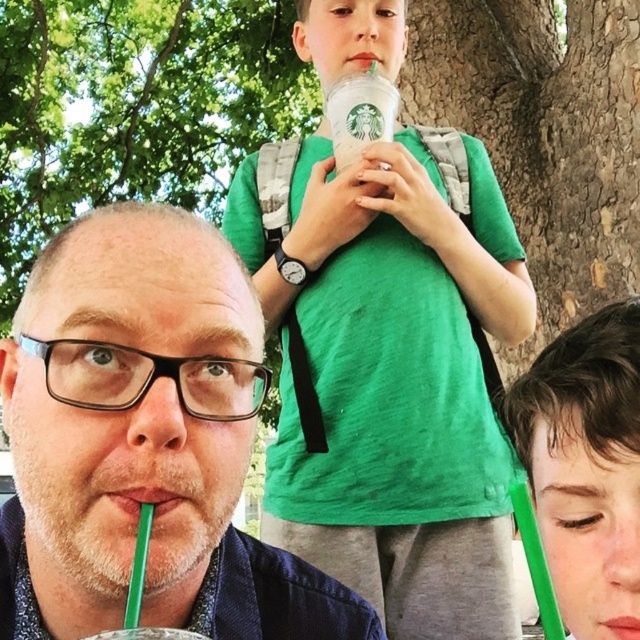
The image size is (640, 640). Describe the element at coordinates (392, 381) in the screenshot. I see `green matte shirt at center` at that location.

Who is more forward, (301, 556) or (362, 93)?

Point (301, 556) is more forward.

Image resolution: width=640 pixels, height=640 pixels. Find the location of `green matte shirt at center`. green matte shirt at center is located at coordinates (392, 381).

This screenshot has height=640, width=640. What are the coordinates of `matte black mug at center` in the screenshot? It's located at (144, 442).

Image resolution: width=640 pixels, height=640 pixels. What do you see at coordinates (144, 442) in the screenshot?
I see `matte black mug at center` at bounding box center [144, 442].

Consider the image. Who is more forward, (202, 525) or (148, 632)?

Positioned in front is point (148, 632).

You are a GUI agent. You are given a task and a screenshot of the screen. Output one action in this format:
    pyautogui.click(x=<x>, y=<y>)
    Task: Click on the matte black mug at center
    
    Given the screenshot: What is the action you would take?
    pyautogui.click(x=144, y=442)

Can you confirm if white paper cup at center is positioned above white paper cup at upper center?

Indeed, white paper cup at center is positioned over white paper cup at upper center.

Does white paper cup at center have a lesser height compared to white paper cup at upper center?

Incorrect, white paper cup at center's height does not fall short of white paper cup at upper center's.

Identify the location of white paper cup at center. (358, 115).

This screenshot has width=640, height=640. I want to click on white paper cup at center, so click(358, 115).